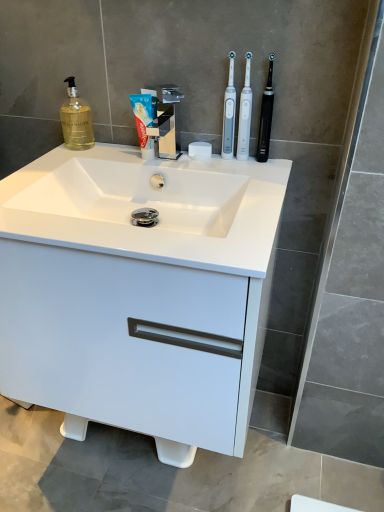
Locate an element on the screen. Image resolution: width=384 pixels, height=512 pixels. vacant area located to the right-hand side of white glossy toothpaste at center is located at coordinates (211, 164).